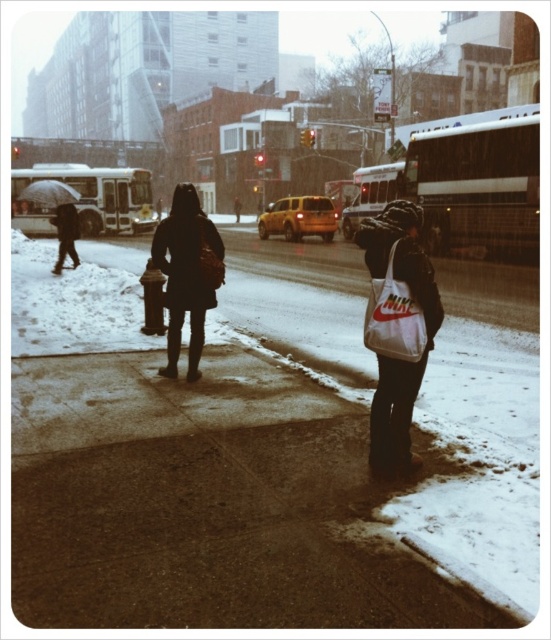
Question: Which of the following is the farthest from the observer?

Choices:
 (A) (213, 248)
 (B) (407, 333)

Answer: (A)

Question: Which point is closer to the camera?

Choices:
 (A) dark matte coat at center
 (B) white fabric tote bag at center-right

Answer: (B)

Question: Is white fabric tote bag at center-right thinner than dark matte coat at center?

Choices:
 (A) no
 (B) yes

Answer: (B)

Question: Does white fabric tote bag at center-right lie behind dark matte coat at center?

Choices:
 (A) yes
 (B) no

Answer: (B)

Question: Is white fabric tote bag at center-right wider than dark matte coat at center?

Choices:
 (A) no
 (B) yes

Answer: (A)